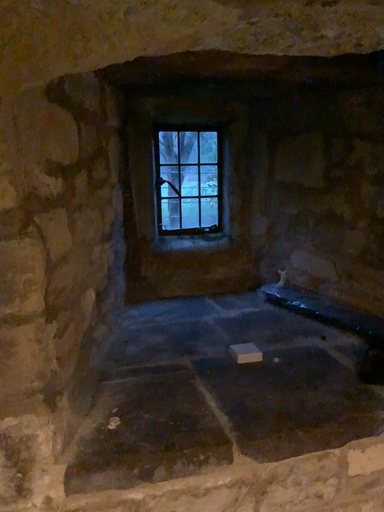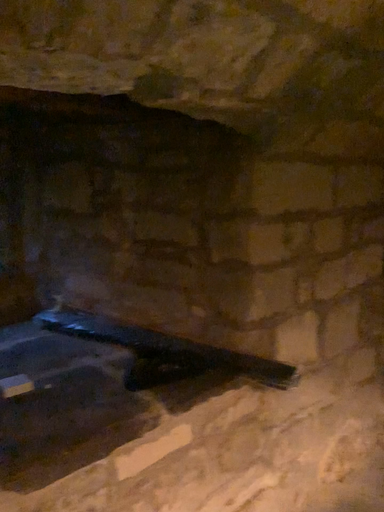
Question: How did the camera likely rotate when shooting the video?

Choices:
 (A) rotated left
 (B) rotated right

Answer: (B)